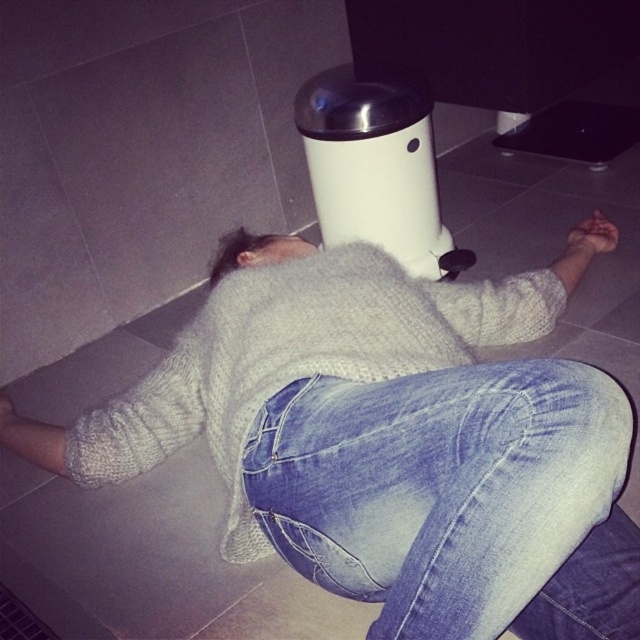
You are a nurse in an emergency room. You see a person lying on the floor wearing a white knitted sweater at center and a white matte water heater at center is nearby. Which object is closer to the entrance of the room?

The white knitted sweater at center is closer to the entrance because it is positioned to the left of the white matte water heater at center, and in most rooms, the entrance is typically located on the left side.

You are a home inspector assessing the layout of a room. You notice the white knitted sweater at center and the white matte water heater at center. Which object occupies more horizontal space in the room?

The white knitted sweater at center has a larger width than the white matte water heater at center, so it occupies more horizontal space in the room.